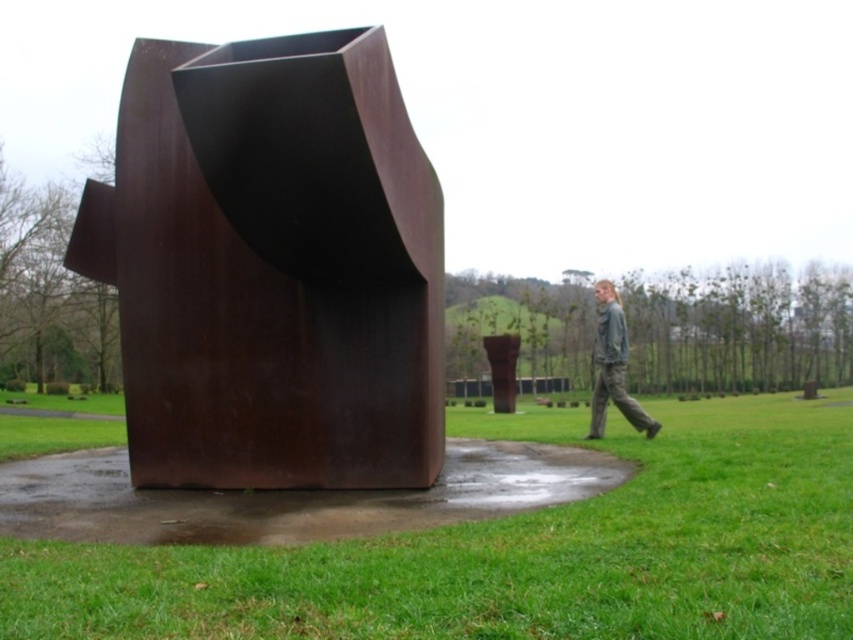
Is green grass at lower center positioned at the back of gray cotton pants at lower right?

No.

Can you confirm if green grass at lower center is thinner than gray cotton pants at lower right?

No.

Who is more forward, (172,552) or (618,339)?

Positioned in front is point (172,552).

Find the location of a particular element. This screenshot has width=853, height=640. green grass at lower center is located at coordinates (519, 554).

Who is higher up, rusty metal sculpture at center or gray cotton pants at lower right?

rusty metal sculpture at center is above.

Can you confirm if rusty metal sculpture at center is smaller than gray cotton pants at lower right?

Incorrect, rusty metal sculpture at center is not smaller in size than gray cotton pants at lower right.

Locate an element on the screen. The width and height of the screenshot is (853, 640). rusty metal sculpture at center is located at coordinates (271, 266).

Does rusty metal sculpture at center have a smaller size compared to green grass at lower center?

Correct, rusty metal sculpture at center occupies less space than green grass at lower center.

Who is positioned more to the right, rusty metal sculpture at center or green grass at lower center?

rusty metal sculpture at center

Does point (178, 275) lie behind point (59, 445)?

No.

Where is `rusty metal sculpture at center`? The image size is (853, 640). rusty metal sculpture at center is located at coordinates (271, 266).